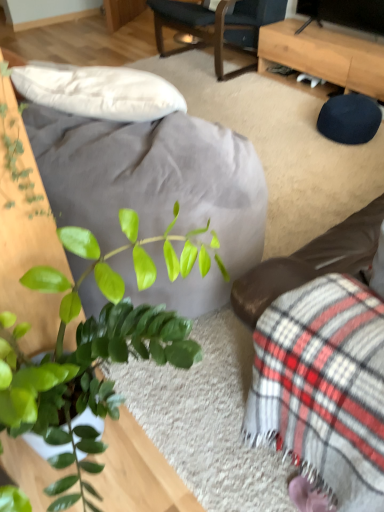
Question: Looking at their shapes, would you say plaid fabric couch at lower right is wider or thinner than dark blue fabric chair at upper center?

Choices:
 (A) thin
 (B) wide

Answer: (A)

Question: From a real-world perspective, is plaid fabric couch at lower right physically located above or below dark blue fabric chair at upper center?

Choices:
 (A) above
 (B) below

Answer: (A)

Question: Considering the real-world distances, which object is farthest from the light brown wooden desk at upper right?

Choices:
 (A) dark blue fabric chair at upper center
 (B) plaid fabric couch at lower right

Answer: (B)

Question: Which is farther from the light brown wooden desk at upper right?

Choices:
 (A) plaid fabric couch at lower right
 (B) dark blue fabric chair at upper center

Answer: (A)